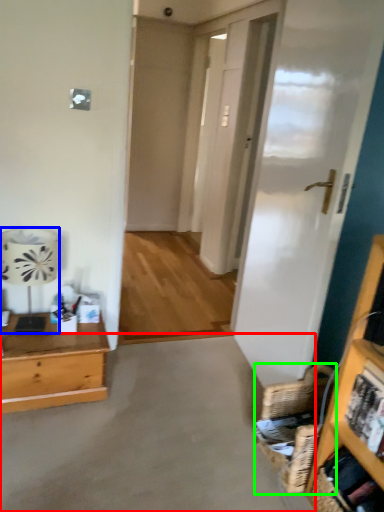
Question: Which object is the farthest from concrete (highlighted by a red box)? Choose among these: lamp (highlighted by a blue box) or basket (highlighted by a green box).

Choices:
 (A) lamp
 (B) basket

Answer: (A)